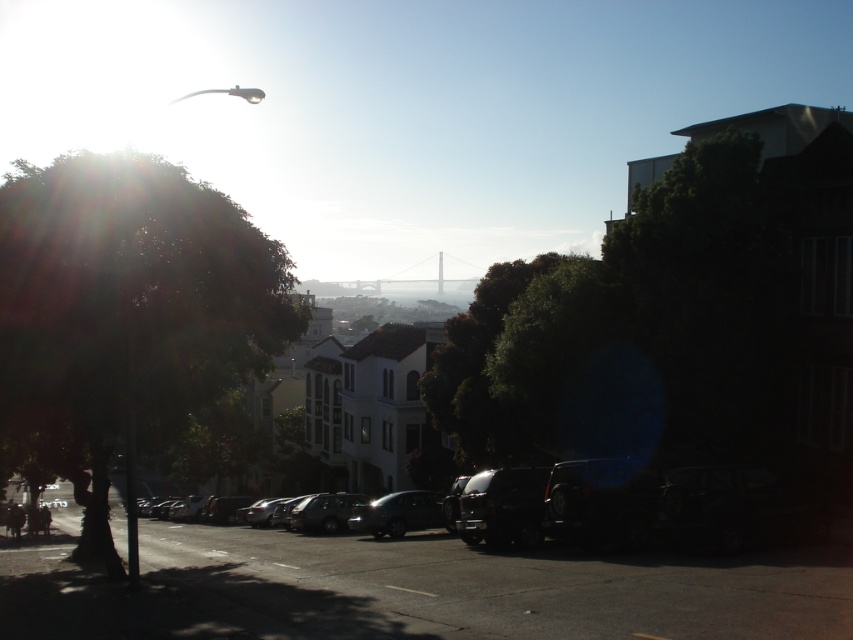
Question: Considering the real-world distances, which object is farthest from the green leafy tree at left?

Choices:
 (A) shiny black car at center
 (B) green leafy tree at center

Answer: (B)

Question: Does green leafy tree at center lie behind shiny black car at center?

Choices:
 (A) yes
 (B) no

Answer: (B)

Question: Estimate the real-world distances between objects in this image. Which object is closer to the green leafy tree at left?

Choices:
 (A) green leafy tree at center
 (B) shiny black car at center

Answer: (B)

Question: Does green leafy tree at center have a smaller size compared to shiny black car at center?

Choices:
 (A) yes
 (B) no

Answer: (B)

Question: Which of the following is the farthest from the observer?

Choices:
 (A) (537, 310)
 (B) (389, 506)

Answer: (B)

Question: Does green leafy tree at center appear under shiny black car at center?

Choices:
 (A) yes
 (B) no

Answer: (B)